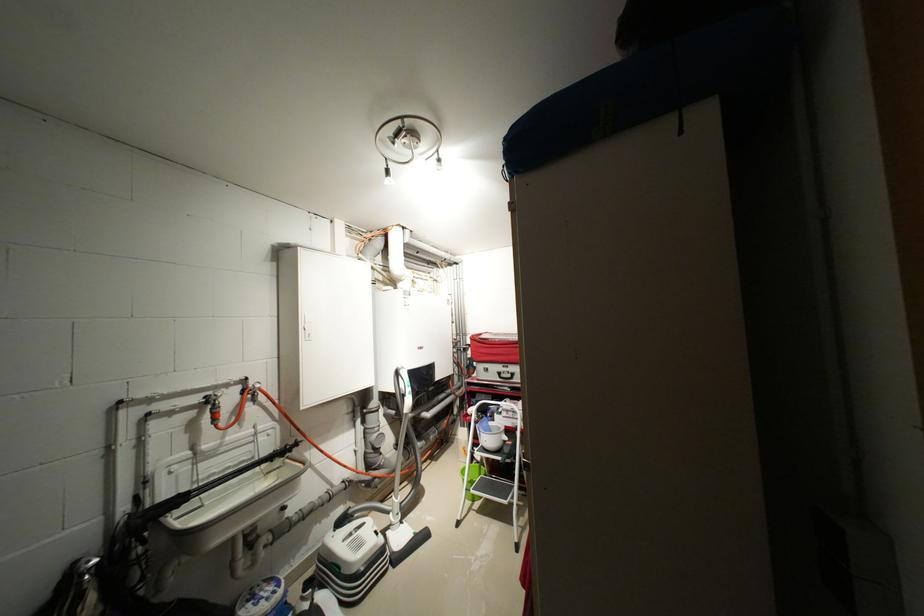
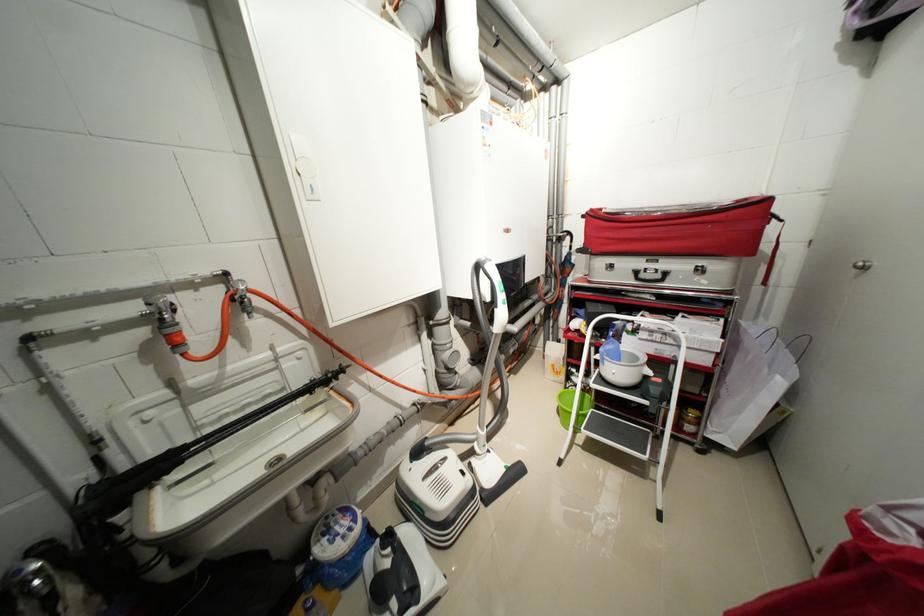
In the second image, find the point that corresponds to (480,336) in the first image.

(599, 211)